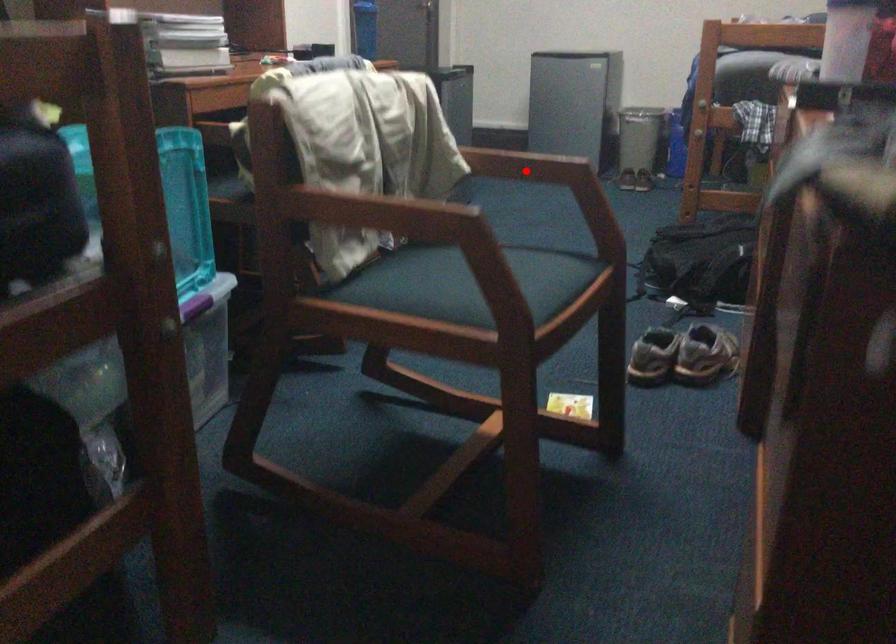
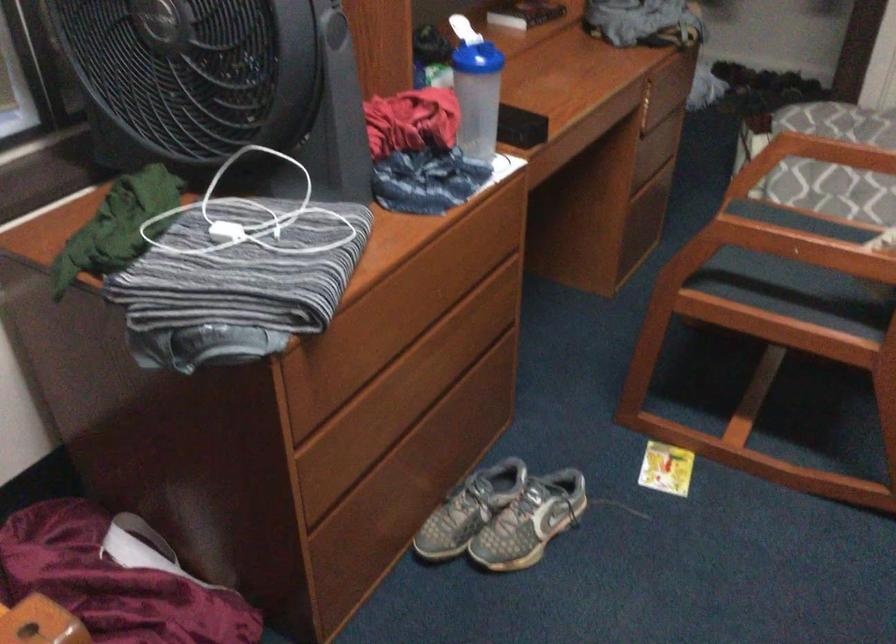
Where in the second image is the point corresponding to the highlighted location from the first image?

(790, 245)